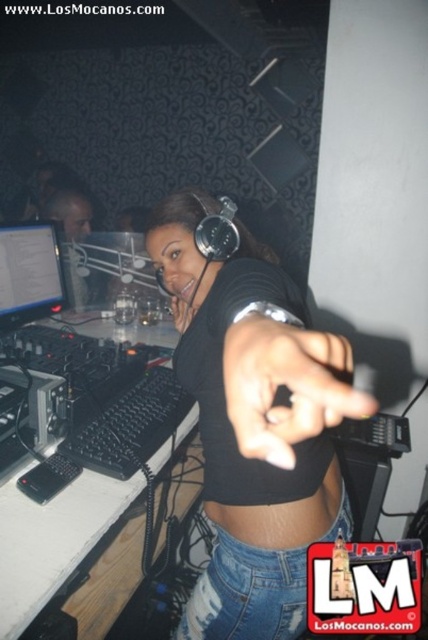
You are standing in the nightclub and notice two points marked in the scene. The first point is at coordinates point (208, 465) and the second is at point (234, 525). Which point is closer to the DJ booth?

Point (208, 465) is behind point (234, 525), so the point closer to the DJ booth is point (234, 525).

You are a technician setting up equipment in a dark nightclub. You need to adjust the matte black monitor at left and the black matte skin at center. Which object is positioned to the left of the other?

The matte black monitor at left is to the left of the black matte skin at center.